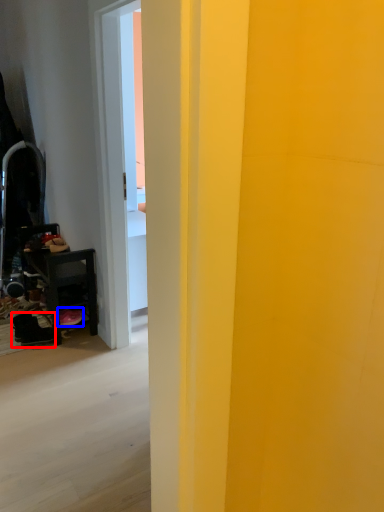
Question: Which point is further to the camera, footwear (highlighted by a red box) or footwear (highlighted by a blue box)?

Choices:
 (A) footwear
 (B) footwear

Answer: (B)